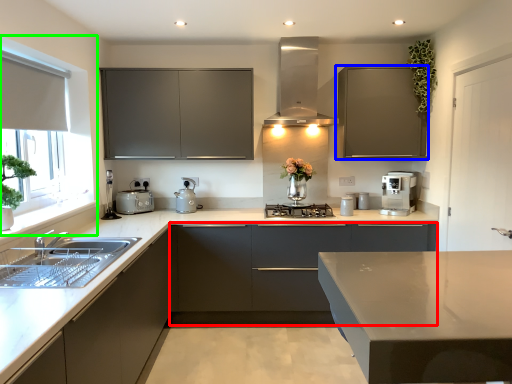
Question: Considering the real-world distances, which object is farthest from cabinetry (highlighted by a red box)? cabinetry (highlighted by a blue box) or window screen (highlighted by a green box)?

Choices:
 (A) cabinetry
 (B) window screen

Answer: (B)